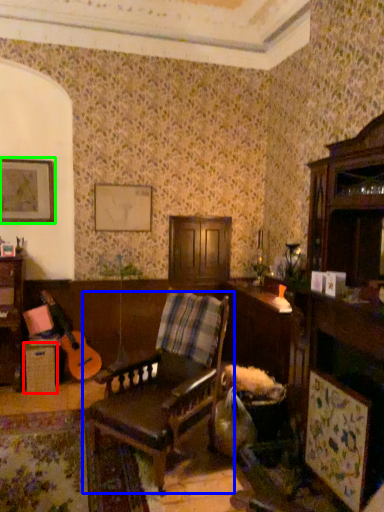
Question: Estimate the real-world distances between objects in this image. Which object is farther from table (highlighted by a red box), chair (highlighted by a blue box) or picture frame (highlighted by a green box)?

Choices:
 (A) chair
 (B) picture frame

Answer: (A)